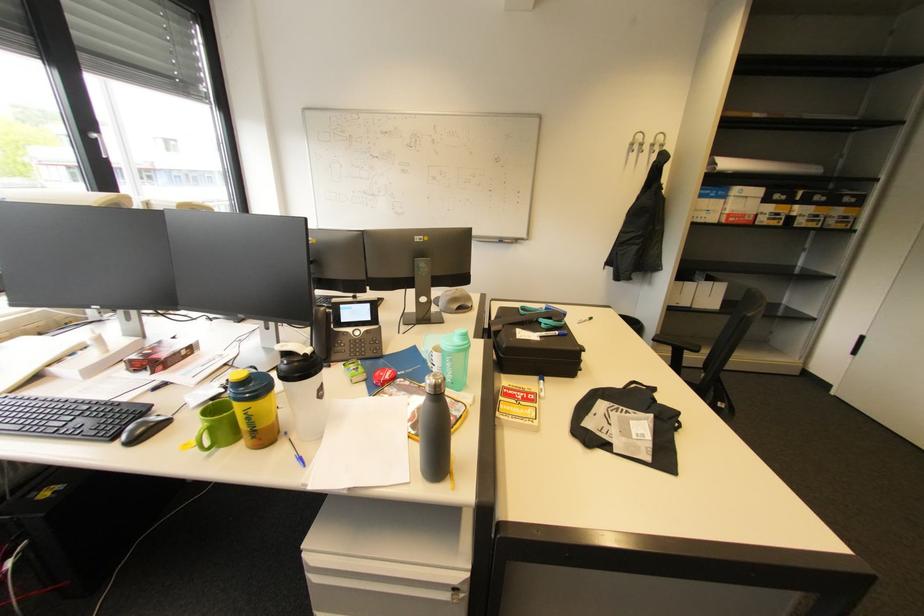
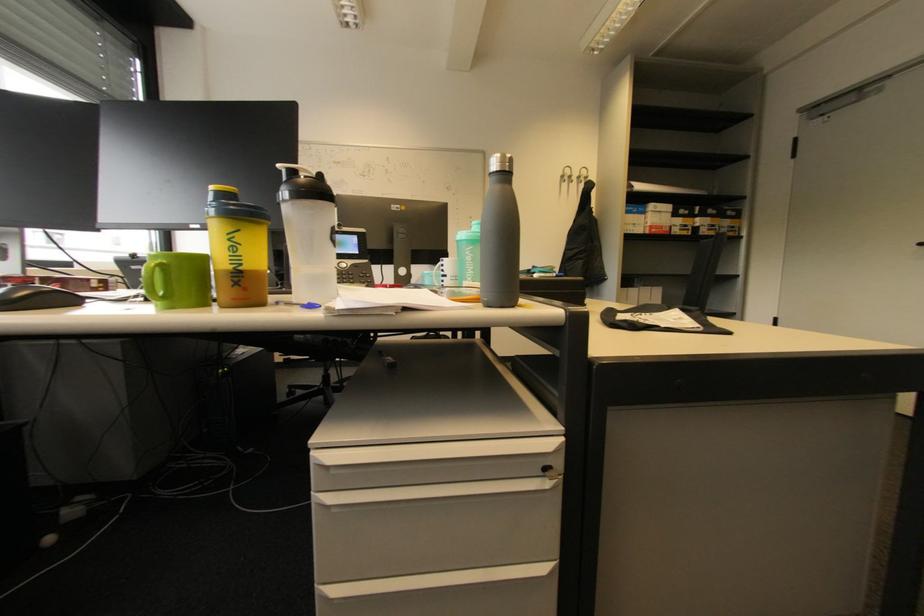
What movement of the cameraman would produce the second image?

The cameraman walked toward left, forward.